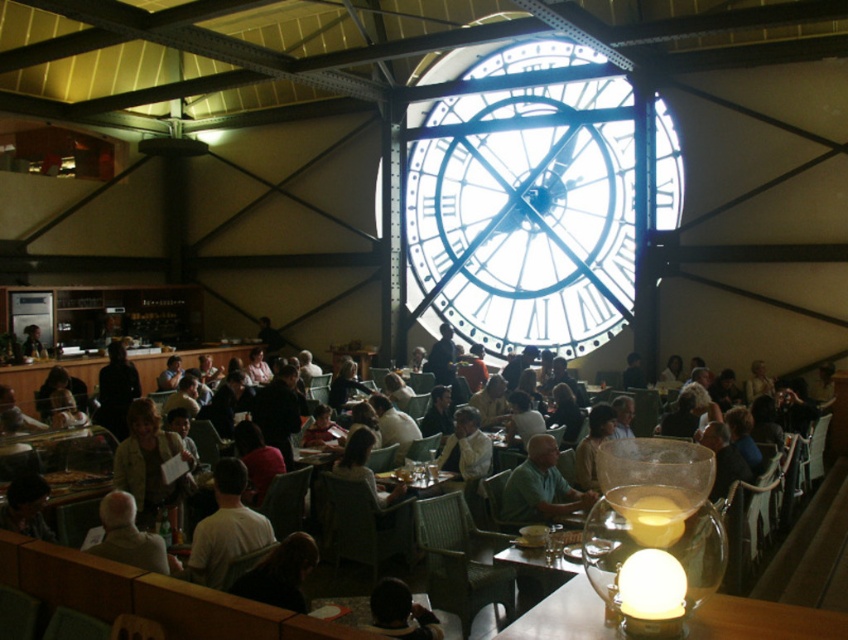
Question: Which is farther from the light brown leather jacket at center?

Choices:
 (A) green matte shirt at center
 (B) white matte shirt at center
 (C) matte wooden table at center

Answer: (A)

Question: Can you confirm if green matte shirt at center is positioned to the right of light beige shirt at lower left?

Choices:
 (A) no
 (B) yes

Answer: (B)

Question: Does translucent glass table at lower right appear under light beige shirt at lower left?

Choices:
 (A) no
 (B) yes

Answer: (B)

Question: Among these objects, which one is nearest to the camera?

Choices:
 (A) green matte shirt at center
 (B) light beige shirt at lower left
 (C) white matte shirt at center

Answer: (B)

Question: Which object appears farthest from the camera in this image?

Choices:
 (A) white matte shirt at center
 (B) green matte shirt at center

Answer: (B)

Question: Is light brown leather jacket at center bigger than light beige shirt at lower left?

Choices:
 (A) no
 (B) yes

Answer: (A)